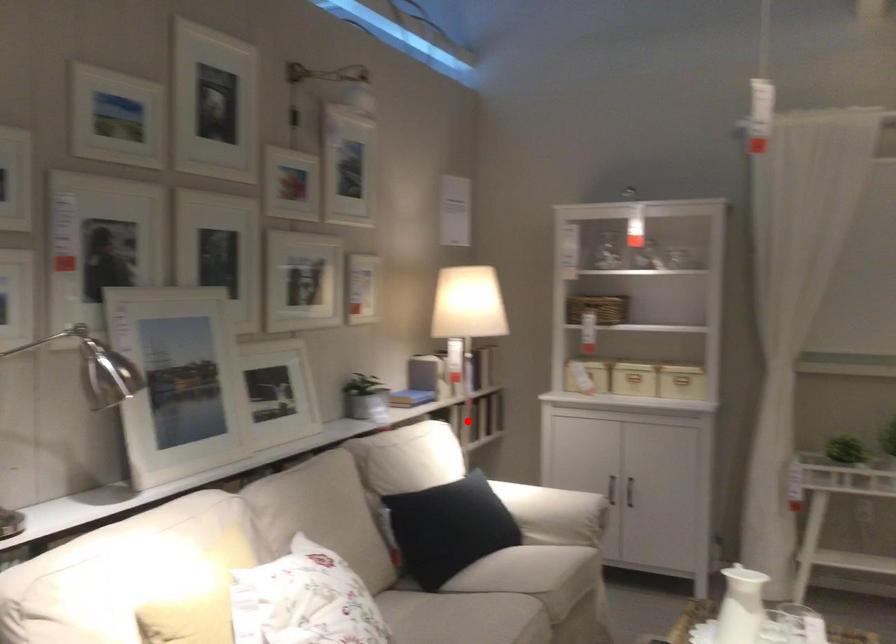
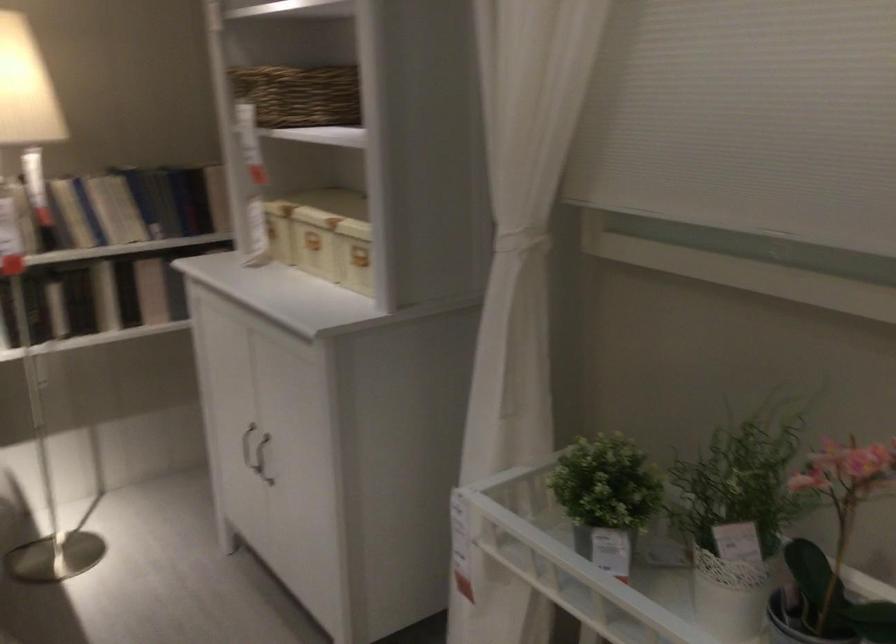
Find the pixel in the second image that matches the highlighted location in the first image.

(105, 296)